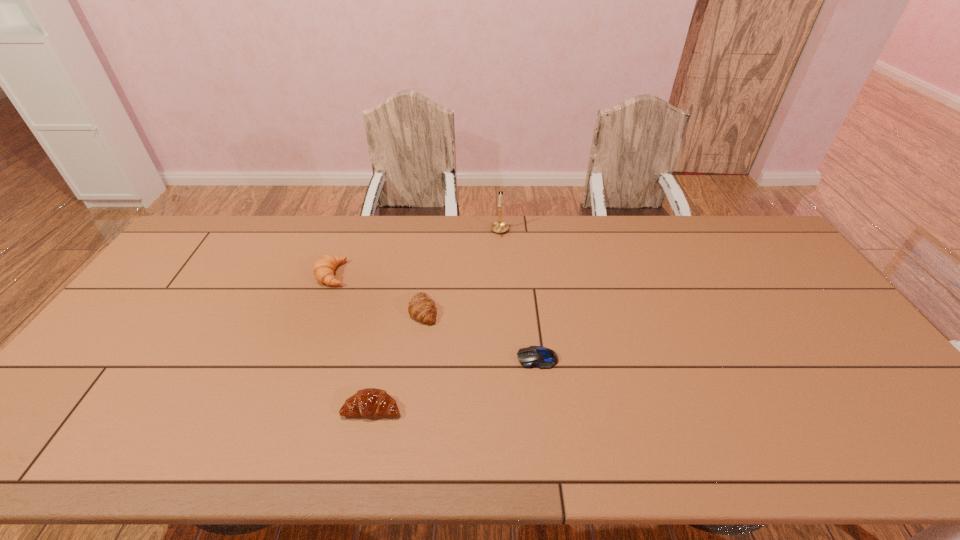
The height and width of the screenshot is (540, 960). Identify the location of the tallest object. (499, 227).

You are a GUI agent. You are given a task and a screenshot of the screen. Output one action in this format:
    pyautogui.click(x=<x>, y=<y>)
    Task: Click on the candle holder
    The width and height of the screenshot is (960, 540).
    Given the screenshot: What is the action you would take?
    pyautogui.click(x=499, y=227)

Where is `the leftmost object`? the leftmost object is located at coordinates (323, 269).

Find the location of a particular element. The image size is (960, 540). the second farthest object is located at coordinates (323, 269).

Locate an element on the screen. The width and height of the screenshot is (960, 540). the second farthest crescent roll is located at coordinates (421, 308).

The image size is (960, 540). Identify the location of the nearest object. [371, 402].

Identify the location of the fourth farthest object. This screenshot has width=960, height=540. 541,357.

Where is `computer mouse`? computer mouse is located at coordinates (541, 357).

Find the location of a particular element. The image size is (960, 540). vacant space located on the handle side of the candle holder is located at coordinates (501, 254).

Find the location of a particular element. vacant region located on the front of the leftmost object is located at coordinates (303, 350).